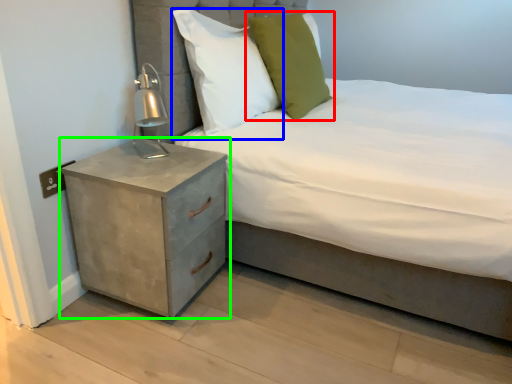
Question: Which object is the closest to the pillow (highlighted by a red box)? Choose among these: pillow (highlighted by a blue box) or nightstand (highlighted by a green box).

Choices:
 (A) pillow
 (B) nightstand

Answer: (A)